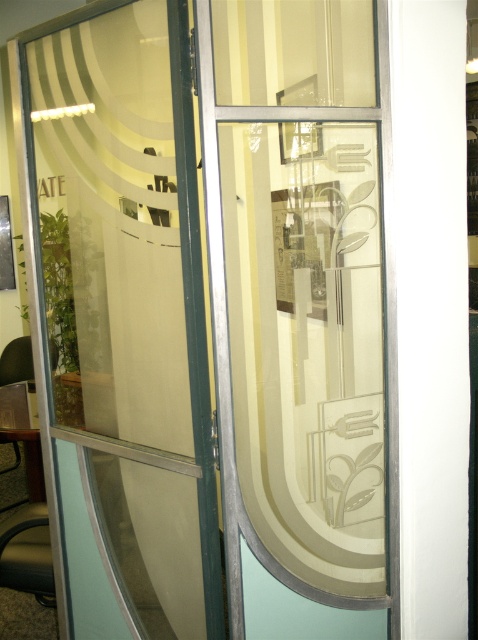
You are an interior designer assessing two doors for a client who prefers privacy. The etched glass door at center allows less light than the clear glass door at center. Which door would you recommend for a more private space?

The etched glass door at center is thinner than clear glass door at center, but since it allows less light, it provides better privacy. Therefore, the etched glass door at center is recommended for a more private space.

Looking at this image, you are a delivery person trying to enter an office through the doors. The etched glass door at center has a decorative pattern, while the clear glass door at center is transparent. Which door should you approach to see through the glass and locate the reception desk?

The clear glass door at center is transparent, allowing you to see through it and locate the reception desk. Approach the clear glass door at center.